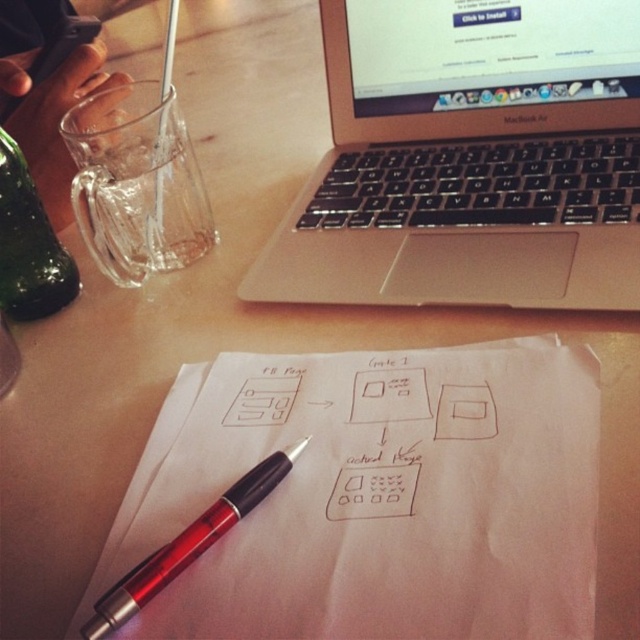
You are organizing a desk and need to place a 25 cm long ruler between the green glass bottle at left and the translucent red pen at center. Can the ruler fit horizontally between them without overlapping either object?

The distance between the green glass bottle at left and the translucent red pen at center is 24.29 centimeters. Since the ruler is 25 cm long, it cannot fit horizontally between them without overlapping either object.

You are an engineer reviewing a technical diagram on the table. You need to locate two specific points marked on the paper. The first point is at coordinate point (528, 48) and the second is at coordinate point (141, 564). Which point is closer to you from your current viewpoint?

Point (528, 48) is behind point (141, 564), so the point closer to you is point (141, 564).

You need to write a note using the translucent red pen at center on the matte paper notepad at center. Will the pen fit on the notepad?

The matte paper notepad at center has a larger size compared to the translucent red pen at center, so yes, the pen will fit on the notepad.